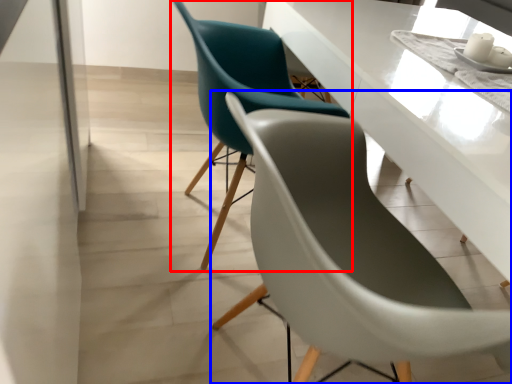
Question: Which of the following is the closest to the observer, chair (highlighted by a red box) or chair (highlighted by a blue box)?

Choices:
 (A) chair
 (B) chair

Answer: (B)